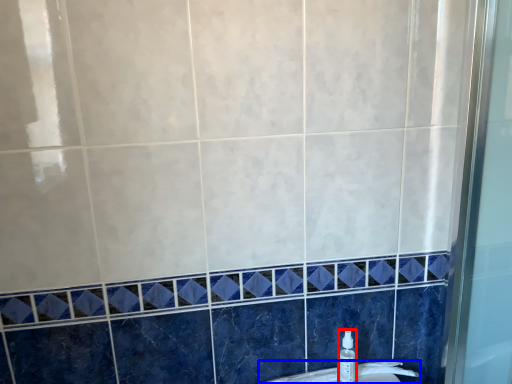
Question: Which object appears closest to the camera in this image, toiletry (highlighted by a red box) or sink (highlighted by a blue box)?

Choices:
 (A) toiletry
 (B) sink

Answer: (A)